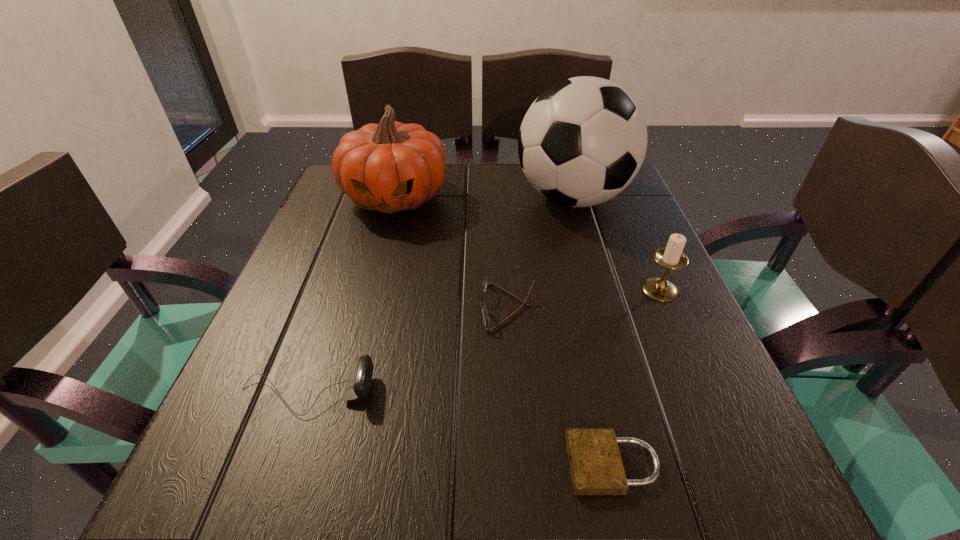
This screenshot has width=960, height=540. Identify the location of vacant region between the second shortest object and the tallest object. (541, 253).

Locate an element on the screen. The image size is (960, 540). free spot between the spectacles and the padlock is located at coordinates (562, 386).

The width and height of the screenshot is (960, 540). Identify the location of vacant space that is in between the spectacles and the tallest object. (541, 253).

Locate an element on the screen. The image size is (960, 540). free spot between the fifth shortest object and the spectacles is located at coordinates (453, 252).

What are the coordinates of `vacant space that is in between the third tallest object and the second nearest object` in the screenshot? It's located at (483, 341).

Find the location of a particular element. free point between the pumpkin and the candle holder is located at coordinates (528, 244).

Where is `object that stands as the third closest to the soccer ball`? The width and height of the screenshot is (960, 540). object that stands as the third closest to the soccer ball is located at coordinates (485, 316).

Identify which object is the third closest to the third shortest object. Please provide its 2D coordinates. Your answer should be formatted as a tuple, i.e. [(x, y)], where the tuple contains the x and y coordinates of a point satisfying the conditions above.

[(389, 167)]

In order to click on vacant area that satisfies the following two spatial constraints: 1. on the face of the fifth shortest object; 2. on the right side of the tallest object in this screenshot , I will do `click(396, 198)`.

At what (x,y) coordinates should I click in order to perform the action: click on free region that satisfies the following two spatial constraints: 1. on the front side of the candle holder; 2. on the front-facing side of the fifth tallest object. Please return your answer as a coordinate pair (x, y). The image size is (960, 540). Looking at the image, I should click on (667, 307).